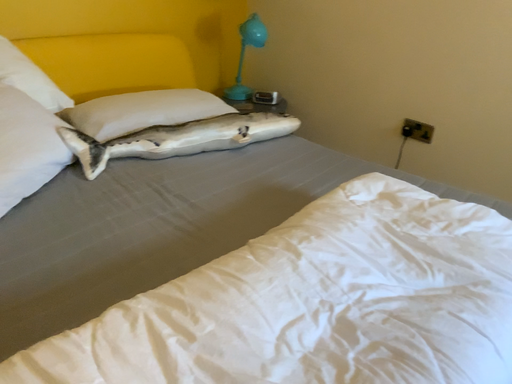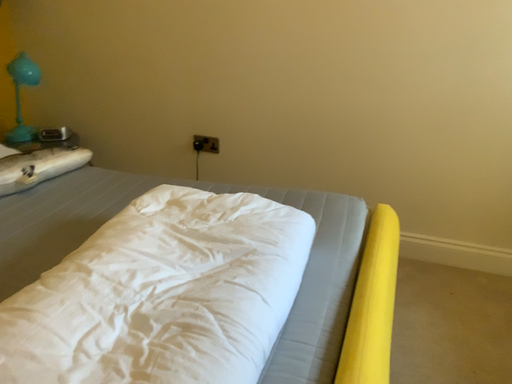
Question: How did the camera likely rotate when shooting the video?

Choices:
 (A) rotated upward
 (B) rotated downward

Answer: (A)